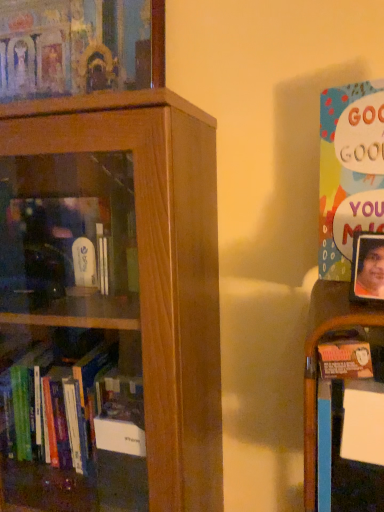
Question: In terms of width, does wooden shelf at right look wider or thinner when compared to brown wooden bookcase at left?

Choices:
 (A) wide
 (B) thin

Answer: (B)

Question: From a real-world perspective, is wooden shelf at right above or below brown wooden bookcase at left?

Choices:
 (A) below
 (B) above

Answer: (B)

Question: Estimate the real-world distances between objects in this image. Which object is farther from the multicolored paper poster at right, the second book positioned from the back?

Choices:
 (A) matte wooden frame at upper left, the 2th book viewed from the right
 (B) wooden shelf at right
 (C) brown wooden bookcase at left

Answer: (A)

Question: Based on their relative distances, which object is farther from the brown wooden bookcase at left?

Choices:
 (A) multicolored paper poster at right, the first book viewed from the front
 (B) matte wooden frame at upper left, which is counted as the second book, starting from the bottom
 (C) wooden shelf at right

Answer: (B)